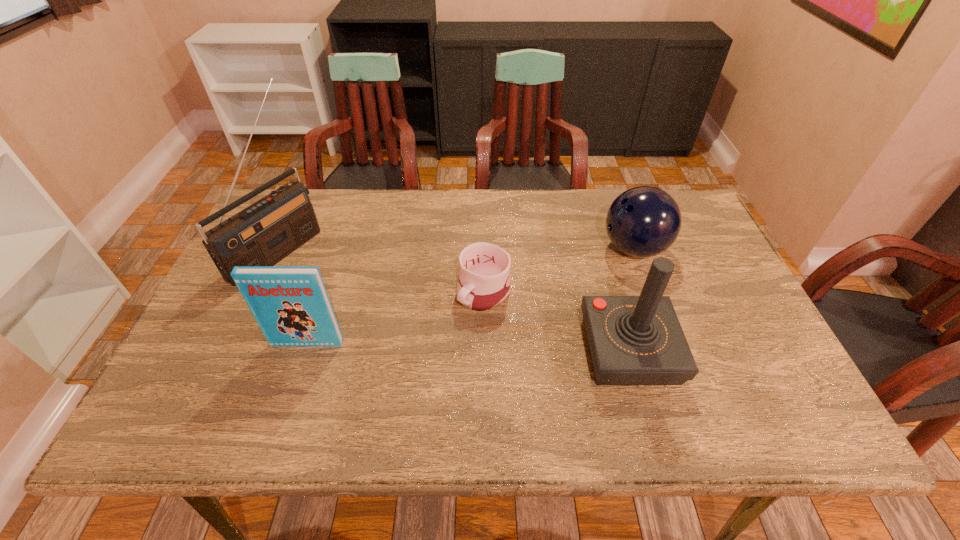
This screenshot has width=960, height=540. In order to click on object situated at the far left corner in this screenshot , I will do `click(264, 233)`.

The image size is (960, 540). I want to click on object present at the far right corner, so click(x=644, y=221).

Identify the location of vacant space at the far edge of the desktop. This screenshot has height=540, width=960. (496, 220).

Locate an element on the screen. vacant space at the near edge of the desktop is located at coordinates (562, 369).

The width and height of the screenshot is (960, 540). What are the coordinates of `free space at the right edge of the desktop` in the screenshot? It's located at (704, 333).

At what (x,y) coordinates should I click in order to perform the action: click on vacant space at the near left corner. Please return your answer as a coordinate pair (x, y). The height and width of the screenshot is (540, 960). Looking at the image, I should click on (231, 370).

Find the location of a particular element. This screenshot has height=540, width=960. free space at the far right corner is located at coordinates (680, 199).

Where is `vacant space at the near right corner of the desktop`? vacant space at the near right corner of the desktop is located at coordinates (743, 372).

Where is `vacant area that lies between the mug and the tallest object`? vacant area that lies between the mug and the tallest object is located at coordinates (381, 271).

Image resolution: width=960 pixels, height=540 pixels. Identify the location of vacant point located between the fourth tallest object and the radio receiver. (456, 249).